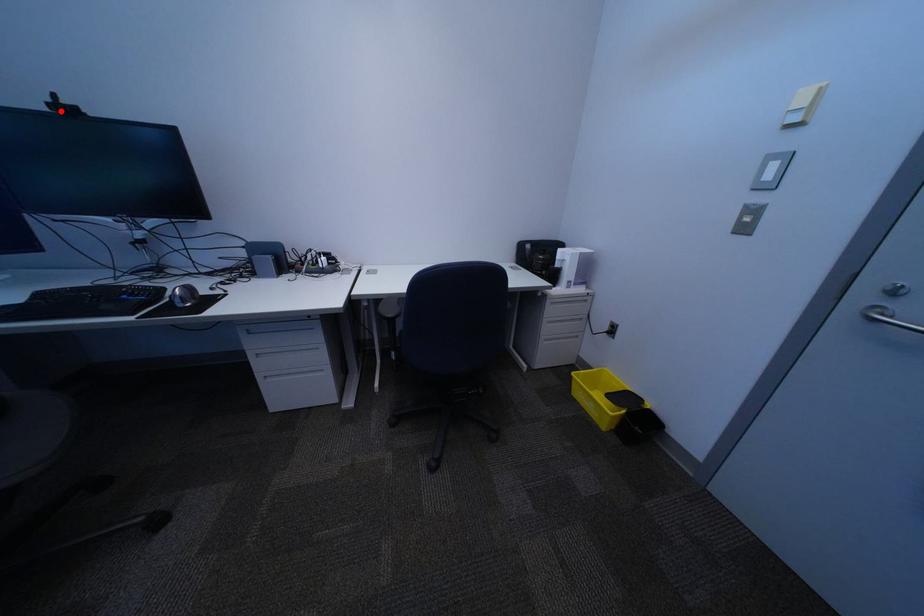
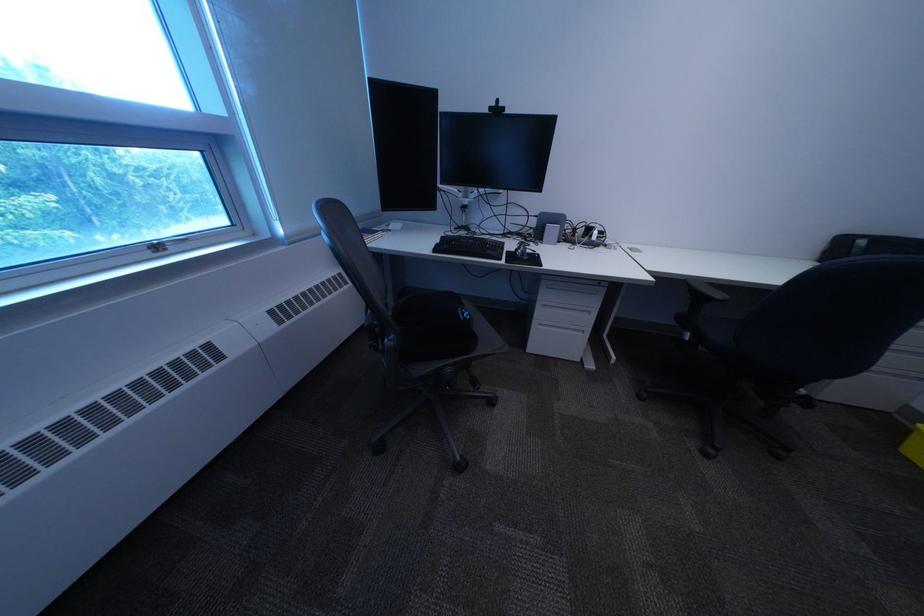
Find the pixel in the second image that matches the highlighted location in the first image.

(503, 113)